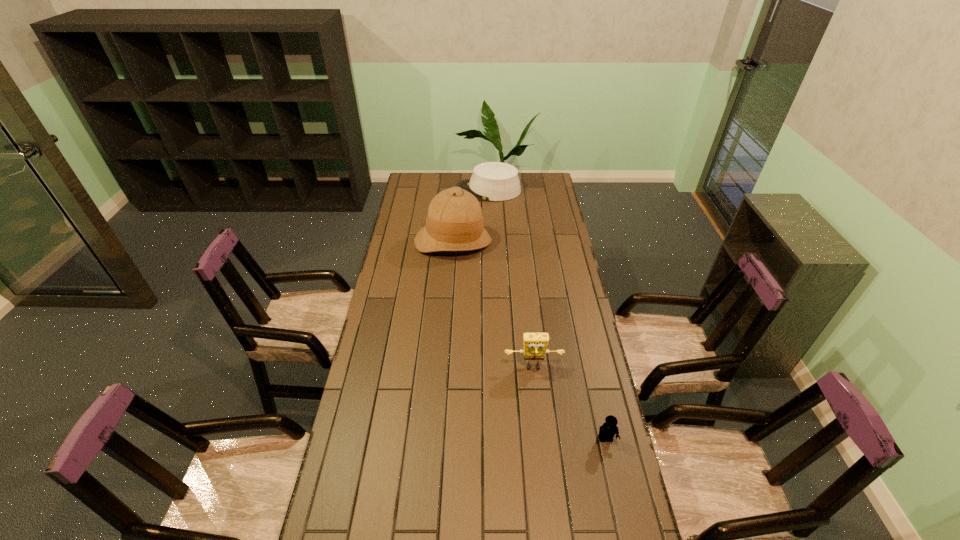
Locate an element on the screen. the third nearest object is located at coordinates (454, 222).

You are a GUI agent. You are given a task and a screenshot of the screen. Output one action in this format:
    pyautogui.click(x=<x>, y=<y>)
    Task: Click on the tallest object
    
    Given the screenshot: What is the action you would take?
    click(454, 222)

In order to click on sponge in this screenshot , I will do `click(535, 344)`.

Identify the location of the third shortest object. (535, 344).

This screenshot has height=540, width=960. Identify the location of the shorter hat. (492, 181).

The width and height of the screenshot is (960, 540). What are the coordinates of `the farther hat` in the screenshot? It's located at (492, 181).

Identify the location of the rightmost object. [607, 431].

In order to click on the nearest object in this screenshot , I will do `click(607, 431)`.

The height and width of the screenshot is (540, 960). What are the coordinates of `free space located 0.400m on the front-facing side of the nearer hat` in the screenshot? It's located at (446, 330).

At what (x,y) coordinates should I click in order to perform the action: click on vacant space located 0.120m on the face of the second nearest object. Please return your answer as a coordinate pair (x, y). Looking at the image, I should click on (538, 406).